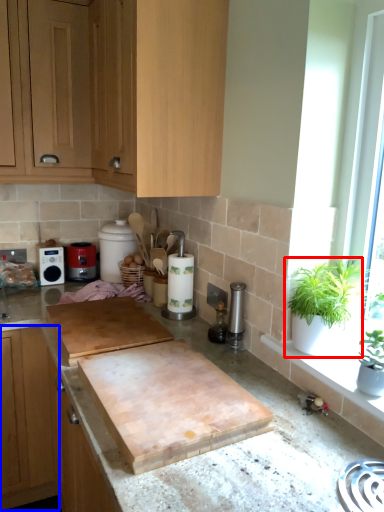
Question: Among these objects, which one is nearest to the camera, houseplant (highlighted by a red box) or cabinetry (highlighted by a blue box)?

Choices:
 (A) houseplant
 (B) cabinetry

Answer: (A)